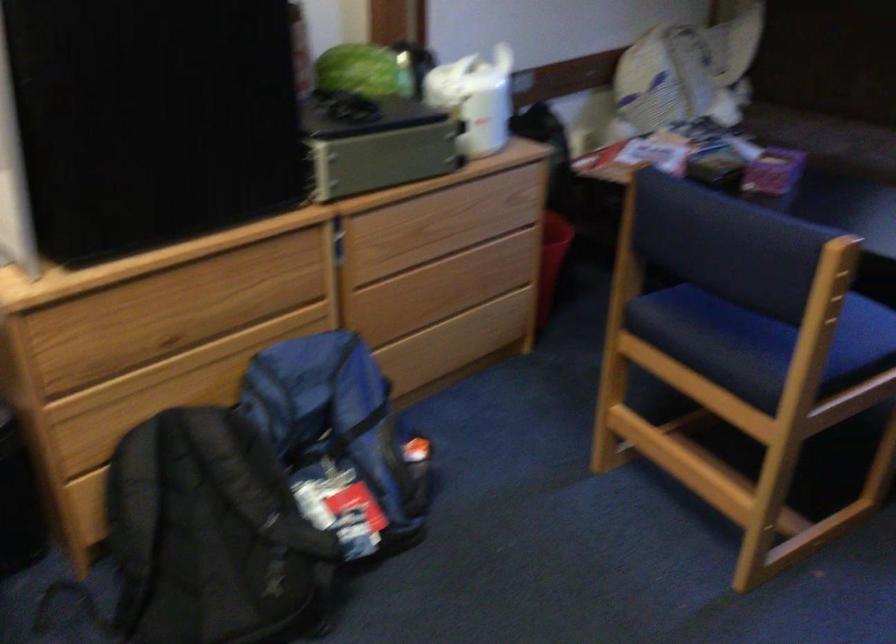
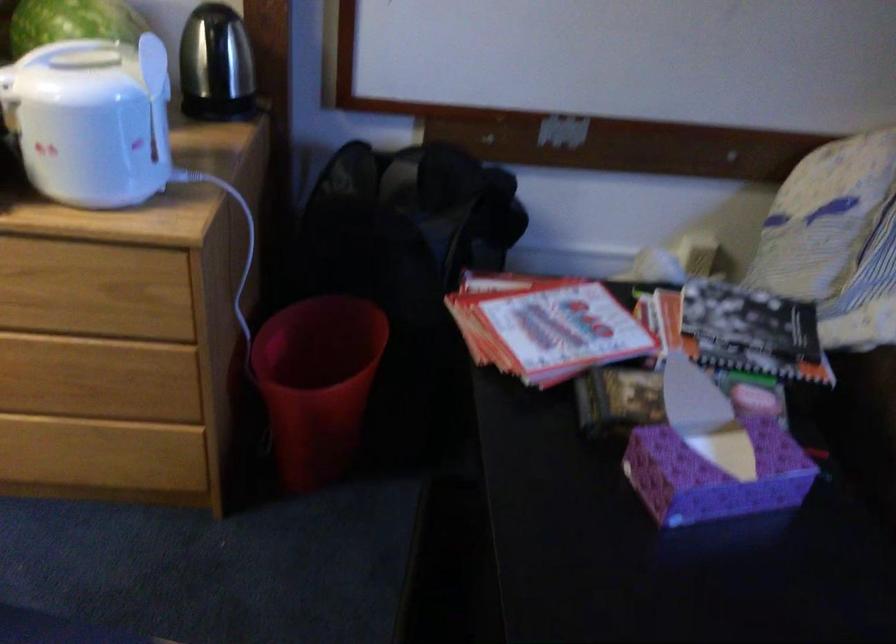
Where in the second image is the point corresponding to the point at 494,78 from the first image?

(156, 97)